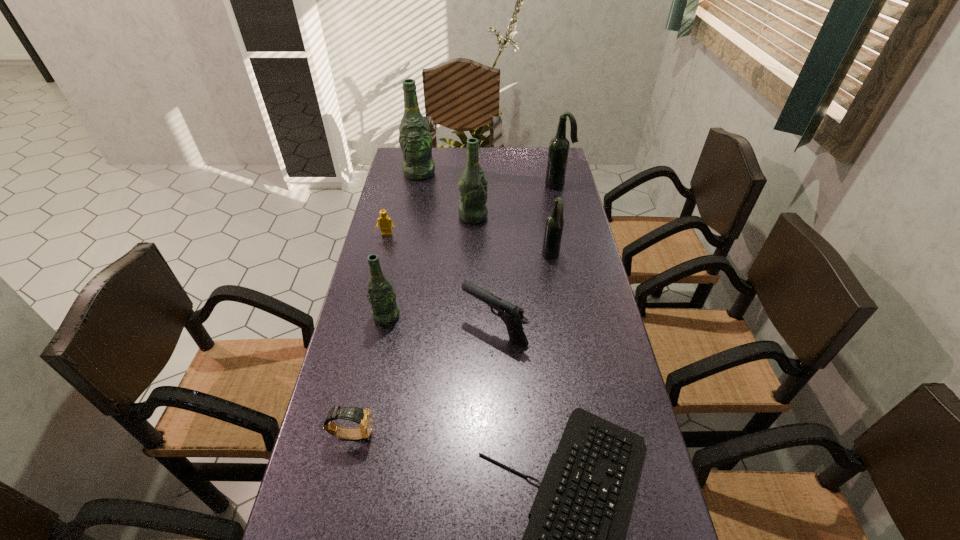
This screenshot has width=960, height=540. I want to click on unoccupied position between the sixth tallest object and the second biggest green beer bottle, so click(484, 273).

Where is `free space between the Lego and the nearest green beer bottle`? free space between the Lego and the nearest green beer bottle is located at coordinates (387, 275).

At what (x,y) coordinates should I click in order to perform the action: click on vacant point located between the rightmost green beer bottle and the bigger dark beer bottle. Please return your answer as a coordinate pair (x, y). This screenshot has width=960, height=540. Looking at the image, I should click on (516, 201).

I want to click on vacant area that lies between the Lego and the nearest beer bottle, so click(x=387, y=275).

The width and height of the screenshot is (960, 540). I want to click on object that is the second closest one to the shortest object, so click(x=363, y=417).

I want to click on object that is the seventh closest one to the fourth farthest object, so 363,417.

Where is `beer bottle that is the third closest one to the smallest green beer bottle`? This screenshot has height=540, width=960. beer bottle that is the third closest one to the smallest green beer bottle is located at coordinates (415, 139).

Locate which beer bottle ranks second in proximity to the Lego. Please provide its 2D coordinates. Your answer should be formatted as a tuple, i.e. [(x, y)], where the tuple contains the x and y coordinates of a point satisfying the conditions above.

[(384, 310)]

Identify the location of green beer bottle that is the closest to the fifth nearest object. click(472, 186).

Where is `green beer bottle identified as the second closest to the tallest object`? The height and width of the screenshot is (540, 960). green beer bottle identified as the second closest to the tallest object is located at coordinates pos(384,310).